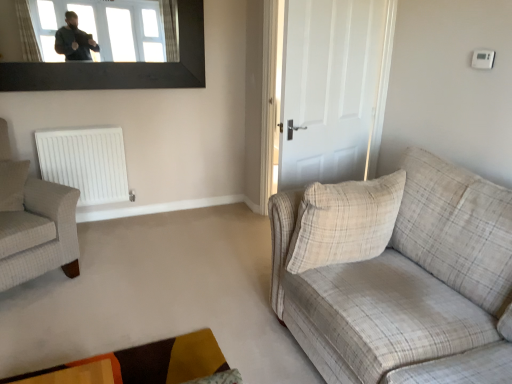
Image resolution: width=512 pixels, height=384 pixels. I want to click on free space above velvet-like brown and orange rug at lower center (from a real-world perspective), so click(x=165, y=360).